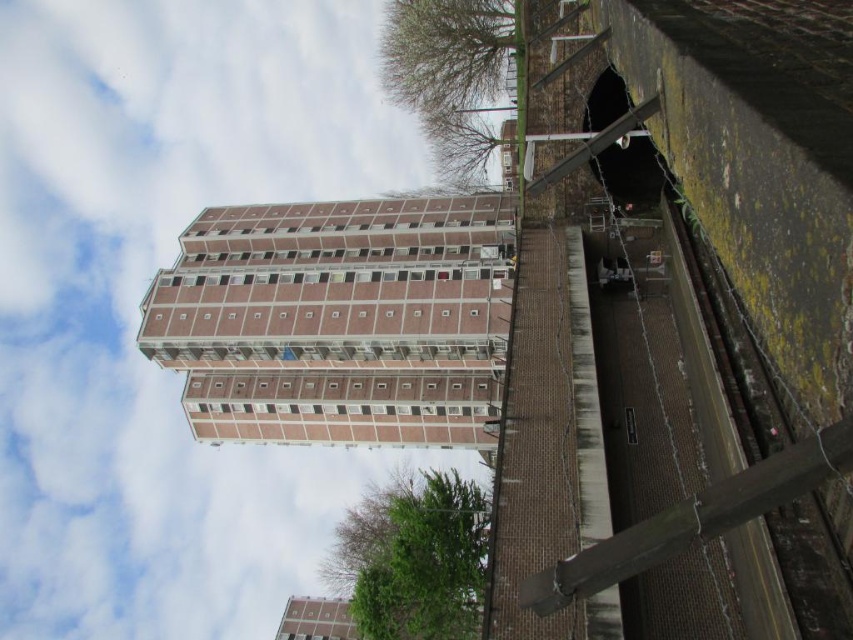
Which of these two, brick building at center or brick textured building at center, stands shorter?

brick textured building at center is shorter.

Does brick building at center have a greater width compared to brick textured building at center?

Yes, brick building at center is wider than brick textured building at center.

Who is more forward, (310, 404) or (346, 605)?

Positioned in front is point (310, 404).

This screenshot has width=853, height=640. I want to click on brick building at center, so click(338, 321).